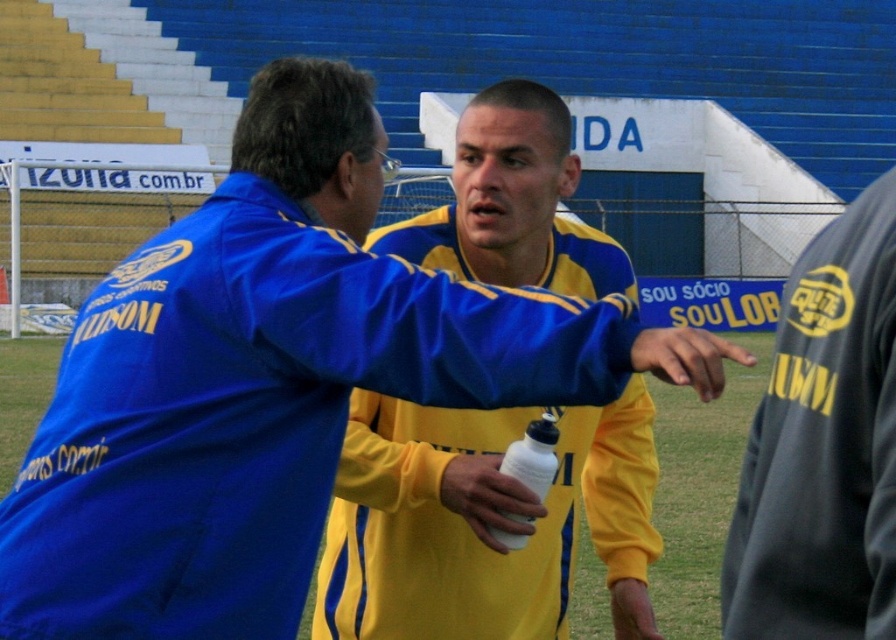
Question: Which point is farther from the camera taking this photo?

Choices:
 (A) (378, 536)
 (B) (857, 246)
 (C) (470, 513)

Answer: (A)

Question: Is the position of dark gray fabric at right less distant than that of white matte water bottle at center?

Choices:
 (A) no
 (B) yes

Answer: (B)

Question: Can you confirm if yellow/yellowish fabric shirt at center is positioned to the left of dark gray fabric at right?

Choices:
 (A) no
 (B) yes

Answer: (B)

Question: Which point is farther to the camera?

Choices:
 (A) (514, 496)
 (B) (794, 554)
 (C) (698, 376)

Answer: (A)

Question: Is dark gray fabric at right positioned in front of white matte bottle at center?

Choices:
 (A) yes
 (B) no

Answer: (A)

Question: Which is nearer to the yellow/yellowish matte/slightly glossy hand at center?

Choices:
 (A) dark gray fabric at right
 (B) white matte water bottle at center
 (C) yellow/yellowish fabric shirt at center

Answer: (A)